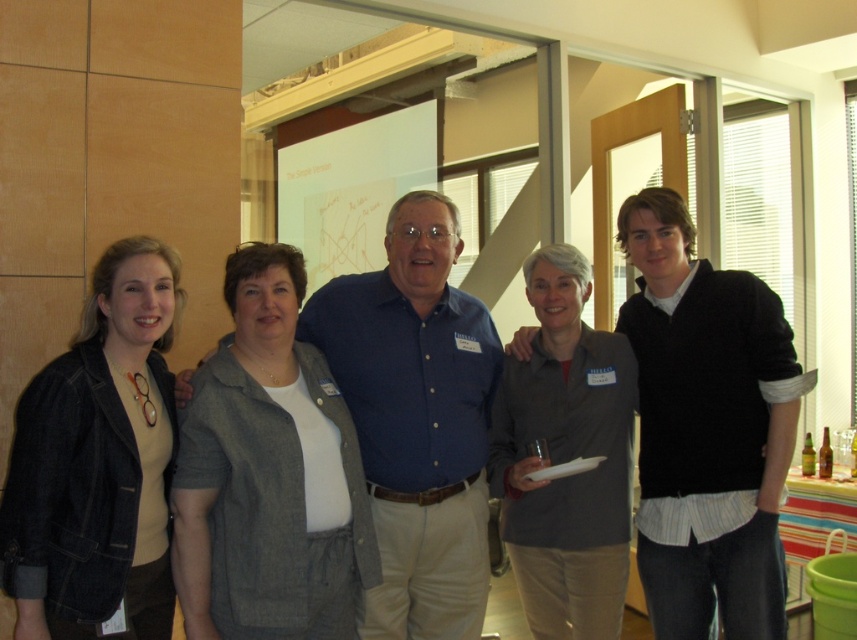
You are standing in the conference room and need to locate the gray fabric shirt at center. According to the coordinates provided, where should you look to find it?

The gray fabric shirt at center is located at the 2D coordinates point (x=706, y=428).

You are organizing a photo shoot and need to ensure that the gray fabric shirt at center and the gray matte shirt at center are visible in the final image. Given their current positions, which shirt is partially covering the other?

The gray fabric shirt at center is positioned over gray matte shirt at center, so the gray fabric shirt at center is partially covering the gray matte shirt at center.